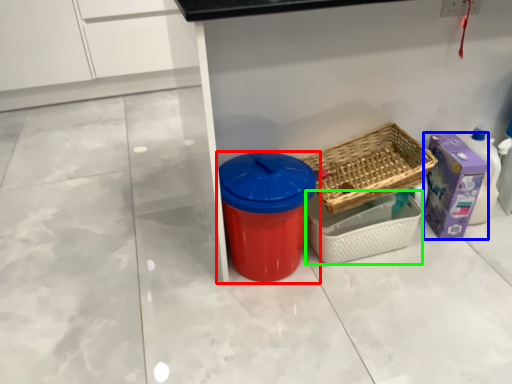
Question: Based on their relative distances, which object is farther from waste container (highlighted by a red box)? Choose from storage box (highlighted by a blue box) and basket (highlighted by a green box).

Choices:
 (A) storage box
 (B) basket

Answer: (A)